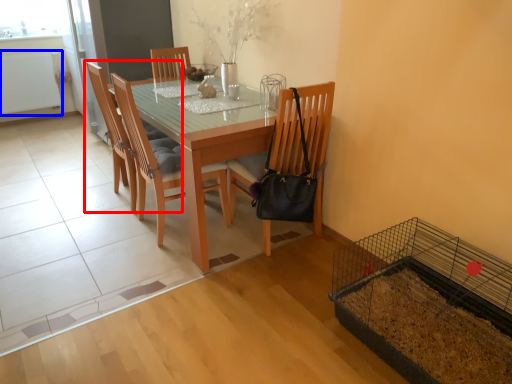
Question: Which object is closer to the camera taking this photo, chair (highlighted by a red box) or radiator (highlighted by a blue box)?

Choices:
 (A) chair
 (B) radiator

Answer: (A)